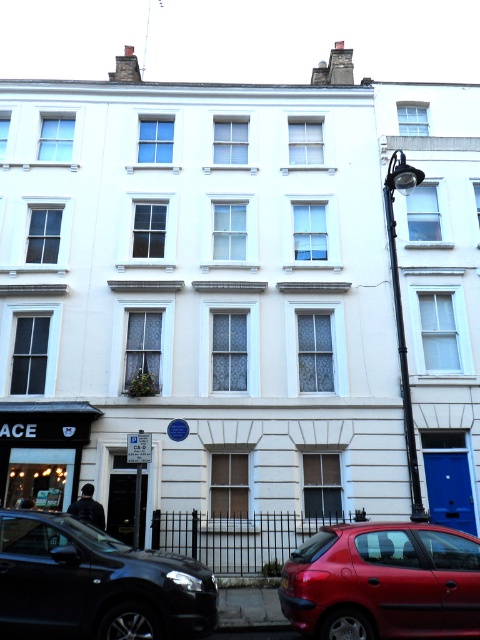
You are a delivery person trying to park between the shiny black suv at lower left and the glossy red car at lower right. The parking spot between them is 1.5 meters wide. Your delivery van is 1.8 meters wide. Can you fit your van between them?

The parking spot between the shiny black suv at lower left and the glossy red car at lower right is 1.5 meters wide, which is narrower than your delivery van that is 1.8 meters wide. Therefore, you cannot fit your van between them.

You are a pedestrian standing in front of the residential building. You see a shiny black suv at lower left and a glossy red car at lower right. Which car is closer to the lamppost?

The shiny black suv at lower left is positioned over the glossy red car at lower right, meaning it is closer to the lamppost on the right side of the image.

You are standing at the entrance of the residential building and want to park your shiny black suv at lower left. Given the coordinates provided, can you determine if the suv is already parked in the designated parking area located at coordinates between 0.8 and 1.0 on the x and y axes?

The shiny black suv at lower left is located at point (96, 582). Since the designated parking area is between 0.8 and 1.0 on both axes, the suv is within the x range but falls below the y range. Therefore, it is not fully within the designated parking area.